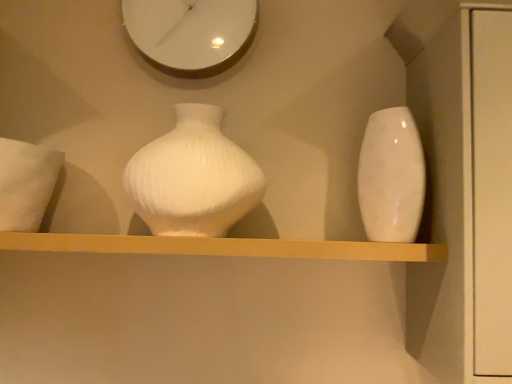
Question: Can you confirm if white soft pillow at left is positioned to the right of glossy ceramic vase at right, arranged as the 2th vase when viewed from the left?

Choices:
 (A) no
 (B) yes

Answer: (A)

Question: Is white soft pillow at left directly adjacent to glossy ceramic vase at right, placed as the first vase when sorted from right to left?

Choices:
 (A) no
 (B) yes

Answer: (A)

Question: Is white soft pillow at left positioned behind glossy ceramic vase at right, arranged as the 2th vase when viewed from the left?

Choices:
 (A) yes
 (B) no

Answer: (B)

Question: From the image's perspective, would you say white soft pillow at left is shown under glossy ceramic vase at right, arranged as the 2th vase when viewed from the left?

Choices:
 (A) no
 (B) yes

Answer: (B)

Question: Is white soft pillow at left positioned in front of glossy ceramic vase at right, placed as the first vase when sorted from right to left?

Choices:
 (A) yes
 (B) no

Answer: (A)

Question: Considering the positions of point (30, 147) and point (204, 34), is point (30, 147) closer or farther from the camera than point (204, 34)?

Choices:
 (A) farther
 (B) closer

Answer: (B)

Question: Is white soft pillow at left to the left or to the right of white glossy clock at upper center in the image?

Choices:
 (A) right
 (B) left

Answer: (B)

Question: From the image's perspective, is white soft pillow at left located above or below white glossy clock at upper center?

Choices:
 (A) above
 (B) below

Answer: (B)

Question: Which is correct: white soft pillow at left is inside white glossy clock at upper center, or outside of it?

Choices:
 (A) outside
 (B) inside

Answer: (A)

Question: From the image's perspective, relative to white soft pillow at left, is white ribbed vase at center, which is the 1th vase in left-to-right order, above or below?

Choices:
 (A) above
 (B) below

Answer: (A)

Question: Is white ribbed vase at center, which is the 1th vase in left-to-right order, to the left or to the right of white soft pillow at left in the image?

Choices:
 (A) left
 (B) right

Answer: (B)

Question: Considering the positions of point (174, 127) and point (38, 215), is point (174, 127) closer or farther from the camera than point (38, 215)?

Choices:
 (A) farther
 (B) closer

Answer: (B)

Question: Considering the positions of white ribbed vase at center, which is the 1th vase in left-to-right order, and white soft pillow at left in the image, is white ribbed vase at center, which is the 1th vase in left-to-right order, bigger or smaller than white soft pillow at left?

Choices:
 (A) small
 (B) big

Answer: (B)

Question: Is white soft pillow at left situated inside white ribbed vase at center, placed as the second vase when sorted from right to left, or outside?

Choices:
 (A) inside
 (B) outside

Answer: (B)

Question: Is white soft pillow at left taller or shorter than white ribbed vase at center, which is the 1th vase in left-to-right order?

Choices:
 (A) short
 (B) tall

Answer: (A)